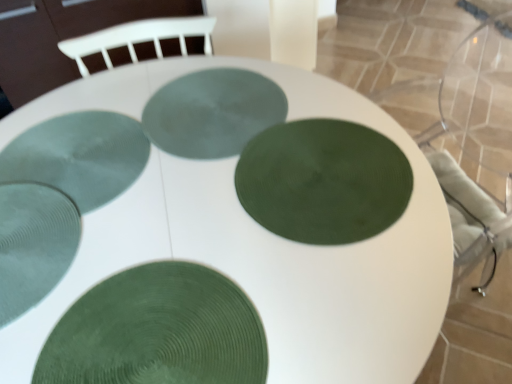
I want to click on empty space that is to the right of green textured glass plate at center, positioned as the 2th glass plate in back-to-front order, so click(208, 152).